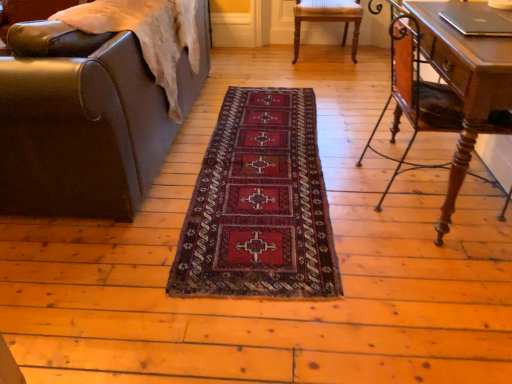
Question: From a real-world perspective, is wooden desk at right over dark red woven rug at center?

Choices:
 (A) no
 (B) yes

Answer: (B)

Question: Is wooden desk at right to the left of dark red woven rug at center from the viewer's perspective?

Choices:
 (A) no
 (B) yes

Answer: (A)

Question: Would you say wooden desk at right is outside dark red woven rug at center?

Choices:
 (A) no
 (B) yes

Answer: (B)

Question: Is wooden desk at right shorter than dark red woven rug at center?

Choices:
 (A) yes
 (B) no

Answer: (B)

Question: Can you confirm if wooden desk at right is smaller than dark red woven rug at center?

Choices:
 (A) yes
 (B) no

Answer: (B)

Question: Considering the relative sizes of wooden desk at right and dark red woven rug at center in the image provided, is wooden desk at right wider than dark red woven rug at center?

Choices:
 (A) yes
 (B) no

Answer: (B)

Question: From the image's perspective, is leather at left, marked as the second chair in a back-to-front arrangement, located above wooden chair at center, which appears as the 1th chair when viewed from the back?

Choices:
 (A) no
 (B) yes

Answer: (A)

Question: Is leather at left, marked as the second chair in a back-to-front arrangement, directly adjacent to wooden chair at center, which appears as the 1th chair when viewed from the back?

Choices:
 (A) yes
 (B) no

Answer: (B)

Question: Is leather at left, marked as the second chair in a back-to-front arrangement, positioned with its back to wooden chair at center, marked as the 2th chair in a left-to-right arrangement?

Choices:
 (A) no
 (B) yes

Answer: (A)

Question: Is leather at left, which is the 1th chair from left to right, at the right side of wooden chair at center, which is the 1th chair from right to left?

Choices:
 (A) no
 (B) yes

Answer: (A)

Question: From a real-world perspective, is leather at left, arranged as the first chair when viewed from the front, under wooden chair at center, which appears as the 2th chair when viewed from the front?

Choices:
 (A) no
 (B) yes

Answer: (A)

Question: Considering the relative sizes of leather at left, marked as the second chair in a back-to-front arrangement, and wooden chair at center, which appears as the 1th chair when viewed from the back, in the image provided, is leather at left, marked as the second chair in a back-to-front arrangement, bigger than wooden chair at center, which appears as the 1th chair when viewed from the back,?

Choices:
 (A) no
 (B) yes

Answer: (B)

Question: Does dark red woven rug at center contain leather at left, arranged as the first chair when viewed from the front?

Choices:
 (A) no
 (B) yes

Answer: (A)